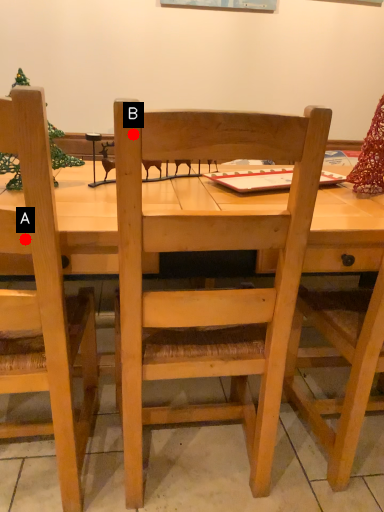
Question: Two points are circled on the image, labeled by A and B beside each circle. Which point is closer to the camera taking this photo?

Choices:
 (A) A is closer
 (B) B is closer

Answer: (B)